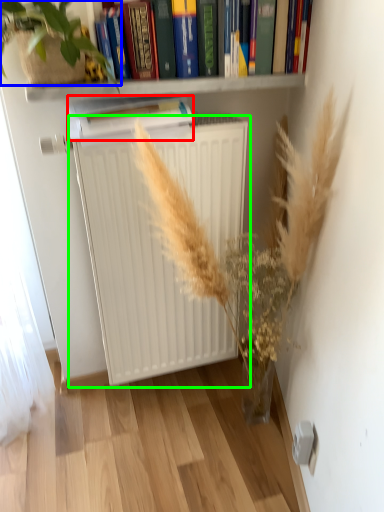
Question: Which object is positioned closest to paperback book (highlighted by a red box)? Select from vegetation (highlighted by a blue box) and radiator (highlighted by a green box).

Choices:
 (A) vegetation
 (B) radiator

Answer: (A)